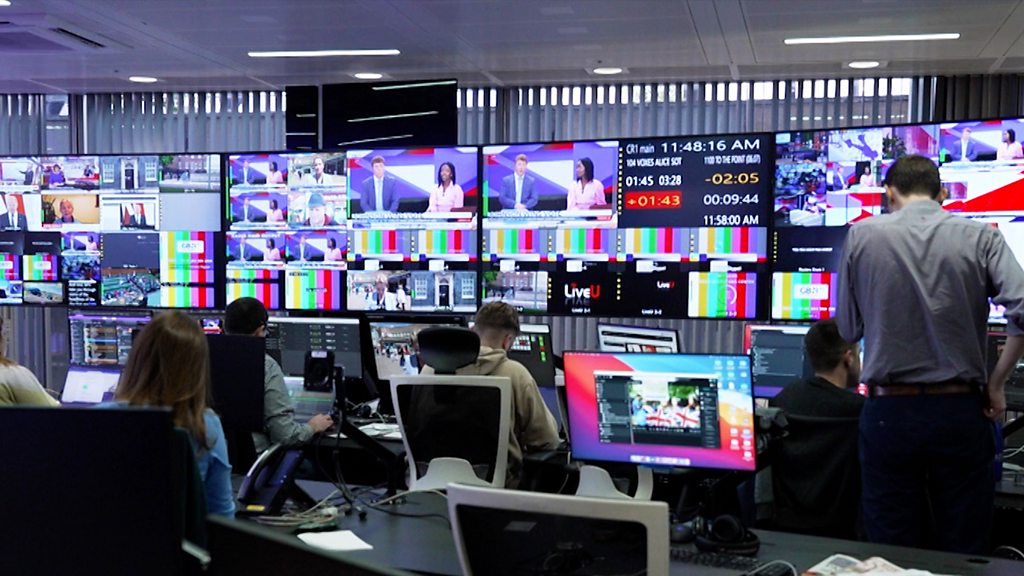
I want to click on chair, so click(x=60, y=476), click(x=231, y=371), click(x=449, y=415), click(x=502, y=519), click(x=820, y=439).